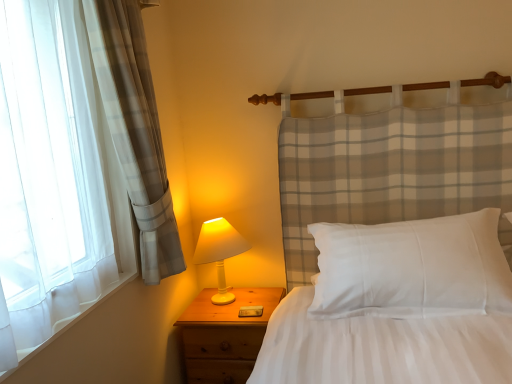
At what (x,y) coordinates should I click in order to perform the action: click on vacant location below white matte table lamp at lower left (from a real-world perspective). Please return your answer as a coordinate pair (x, y). Looking at the image, I should click on (227, 299).